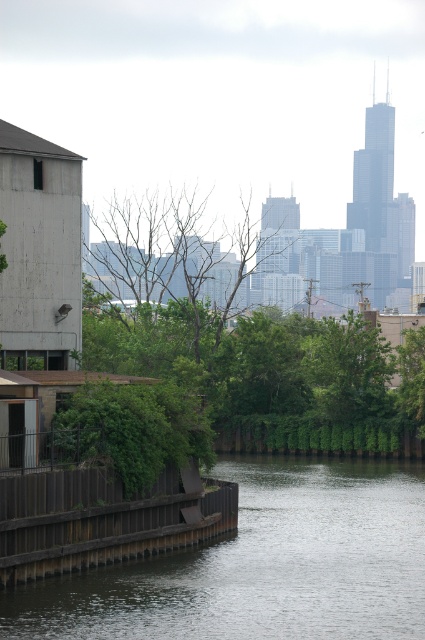
Is point (212, 572) farther from camera compared to point (59, 486)?

That is True.

Between dark gray concrete river at lower center and brown wooden dock at lower left, which one has more height?

With more height is brown wooden dock at lower left.

What do you see at coordinates (260, 564) in the screenshot? I see `dark gray concrete river at lower center` at bounding box center [260, 564].

This screenshot has width=425, height=640. I want to click on dark gray concrete river at lower center, so click(x=260, y=564).